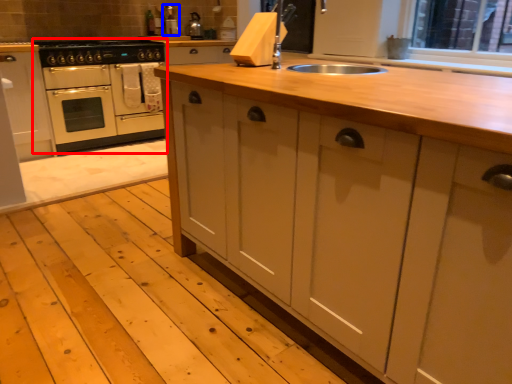
Question: Among these objects, which one is nearest to the camera, home appliance (highlighted by a red box) or appliance (highlighted by a blue box)?

Choices:
 (A) home appliance
 (B) appliance

Answer: (A)